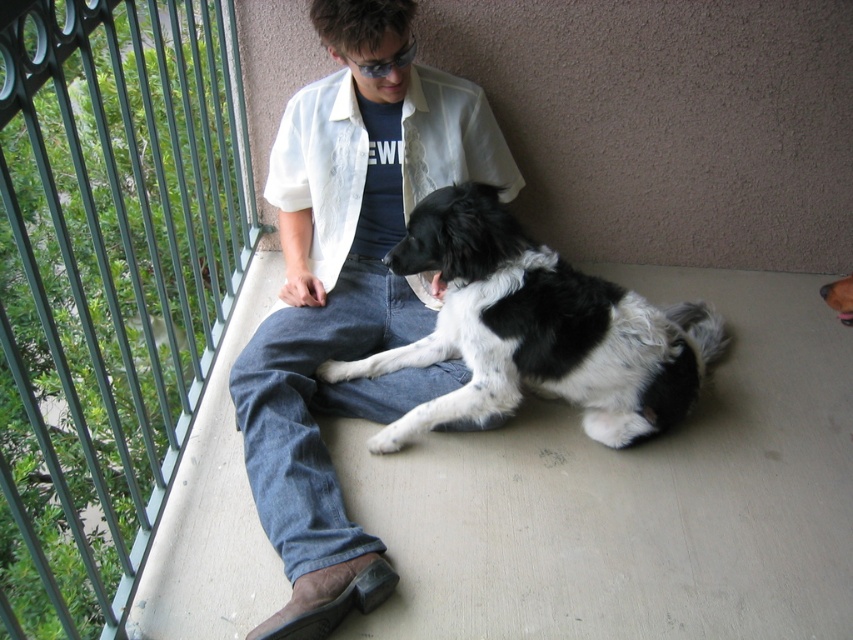
Between green metal fence at left and white cotton shirt at center, which one appears on the right side from the viewer's perspective?

From the viewer's perspective, white cotton shirt at center appears more on the right side.

Is point (57, 26) less distant than point (344, 218)?

Yes, point (57, 26) is closer to viewer.

I want to click on green metal fence at left, so 108,284.

Is green metal fence at left to the right of black and white fur dog at center from the viewer's perspective?

Incorrect, green metal fence at left is not on the right side of black and white fur dog at center.

Describe the element at coordinates (108, 284) in the screenshot. The height and width of the screenshot is (640, 853). I see `green metal fence at left` at that location.

Who is more distant from viewer, (x=113, y=326) or (x=590, y=388)?

The point (x=113, y=326) is more distant.

Locate an element on the screen. This screenshot has height=640, width=853. green metal fence at left is located at coordinates (108, 284).

From the picture: Which is more to the right, white cotton shirt at center or black and white fur dog at center?

From the viewer's perspective, black and white fur dog at center appears more on the right side.

Can you confirm if white cotton shirt at center is taller than black and white fur dog at center?

Yes.

Between point (401, 296) and point (511, 220), which one is positioned in front?

Point (511, 220) is more forward.

I want to click on white cotton shirt at center, so click(349, 289).